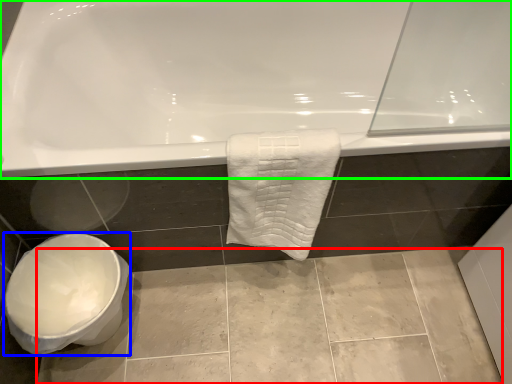
Question: Based on their relative distances, which object is farther from ceramic tile (highlighted by a red box)? Choose from toilet bowl (highlighted by a blue box) and bathtub (highlighted by a green box).

Choices:
 (A) toilet bowl
 (B) bathtub

Answer: (B)